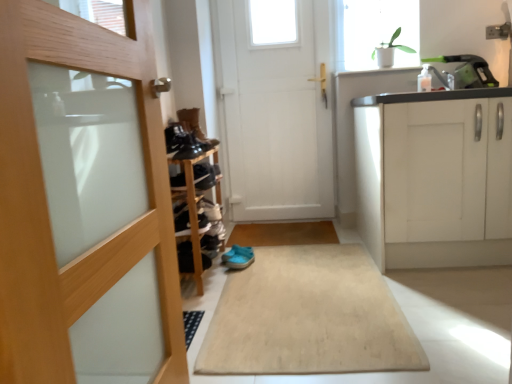
Question: From the image's perspective, would you say shiny black shoes at center, the 2th shoe in the top-to-bottom sequence, is positioned over shiny black shoe at center, marked as the third shoe in a top-to-bottom arrangement?

Choices:
 (A) no
 (B) yes

Answer: (B)

Question: Is shiny black shoes at center, which ranks as the fourth shoe in back-to-front order, closer to camera compared to shiny black shoe at center, which is the fourth shoe from front to back?

Choices:
 (A) no
 (B) yes

Answer: (B)

Question: From a real-world perspective, is shiny black shoes at center, which ranks as the fourth shoe in back-to-front order, over shiny black shoe at center, marked as the third shoe in a top-to-bottom arrangement?

Choices:
 (A) no
 (B) yes

Answer: (B)

Question: From the image's perspective, would you say shiny black shoes at center, which is the fourth shoe from bottom to top, is shown under shiny black shoe at center, marked as the third shoe in a top-to-bottom arrangement?

Choices:
 (A) no
 (B) yes

Answer: (A)

Question: Can you confirm if shiny black shoes at center, which ranks as the fourth shoe in back-to-front order, is wider than shiny black shoe at center, marked as the third shoe in a top-to-bottom arrangement?

Choices:
 (A) no
 (B) yes

Answer: (A)

Question: Based on their sizes in the image, would you say black suede shoe at center, acting as the fourth shoe starting from the top, is bigger or smaller than light blue fabric slipper at center?

Choices:
 (A) small
 (B) big

Answer: (B)

Question: From their relative heights in the image, would you say black suede shoe at center, arranged as the 2th shoe when ordered from the bottom, is taller or shorter than light blue fabric slipper at center?

Choices:
 (A) short
 (B) tall

Answer: (B)

Question: Would you say black suede shoe at center, arranged as the 2th shoe when ordered from the bottom, is inside or outside light blue fabric slipper at center?

Choices:
 (A) inside
 (B) outside

Answer: (B)

Question: From a real-world perspective, is black suede shoe at center, which ranks as the fifth shoe in back-to-front order, positioned above or below light blue fabric slipper at center?

Choices:
 (A) above
 (B) below

Answer: (A)

Question: Would you say white glossy sink at upper right is to the left or to the right of shiny black shoes at center, the 2th shoe in the top-to-bottom sequence, in the picture?

Choices:
 (A) right
 (B) left

Answer: (A)

Question: Is white glossy sink at upper right bigger or smaller than shiny black shoes at center, which is the 2th shoe from front to back?

Choices:
 (A) small
 (B) big

Answer: (B)

Question: Is white glossy sink at upper right wider or thinner than shiny black shoes at center, which is the fourth shoe from bottom to top?

Choices:
 (A) thin
 (B) wide

Answer: (A)

Question: From their relative heights in the image, would you say white glossy sink at upper right is taller or shorter than shiny black shoes at center, which ranks as the fourth shoe in back-to-front order?

Choices:
 (A) tall
 (B) short

Answer: (A)

Question: Considering the positions of black suede shoe at center, acting as the fourth shoe starting from the top, and white matte door at center, the 1th door viewed from the back, in the image, is black suede shoe at center, acting as the fourth shoe starting from the top, wider or thinner than white matte door at center, the 1th door viewed from the back,?

Choices:
 (A) thin
 (B) wide

Answer: (B)

Question: Relative to white matte door at center, which is counted as the 1th door, starting from the right, is black suede shoe at center, marked as the 1th shoe in a front-to-back arrangement, in front or behind?

Choices:
 (A) behind
 (B) front

Answer: (B)